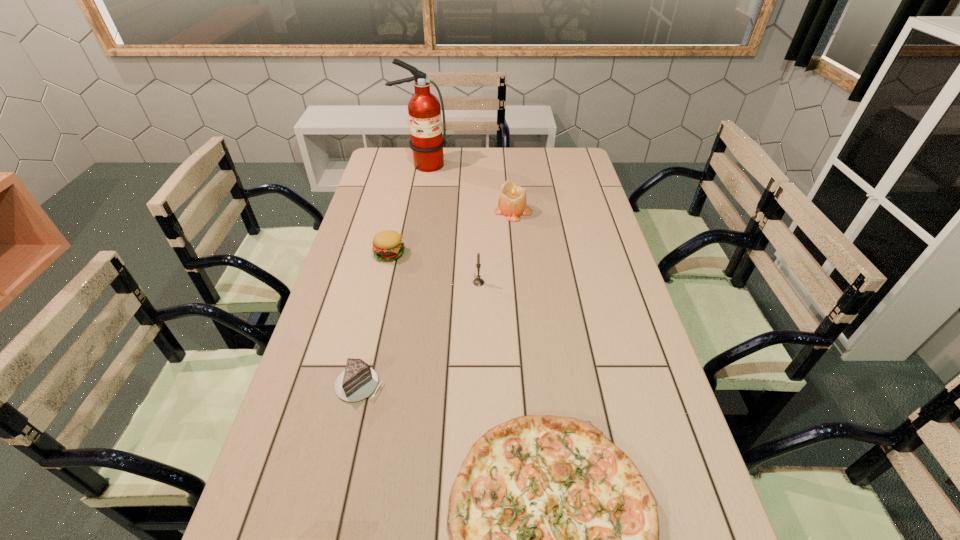
Locate an element on the screen. The width and height of the screenshot is (960, 540). fire extinguisher is located at coordinates (424, 110).

This screenshot has width=960, height=540. I want to click on the farthest object, so click(x=424, y=110).

Find the location of a particular element. the right candle is located at coordinates point(512,203).

Locate an element on the screen. This screenshot has height=540, width=960. the farther candle is located at coordinates (512, 203).

Image resolution: width=960 pixels, height=540 pixels. In order to click on the nearer candle in this screenshot , I will do click(x=478, y=281).

What are the coordinates of `the fourth farthest object` in the screenshot? It's located at (478, 281).

Find the location of a particular element. The image size is (960, 540). hamburger is located at coordinates (388, 245).

The image size is (960, 540). I want to click on the fourth nearest object, so click(388, 245).

At what (x,y) coordinates should I click in order to perform the action: click on the fifth farthest object. Please return your answer as a coordinate pair (x, y). Looking at the image, I should click on (358, 381).

What are the coordinates of `free space located on the nozzle and handle of the tallest object` in the screenshot? It's located at (412, 217).